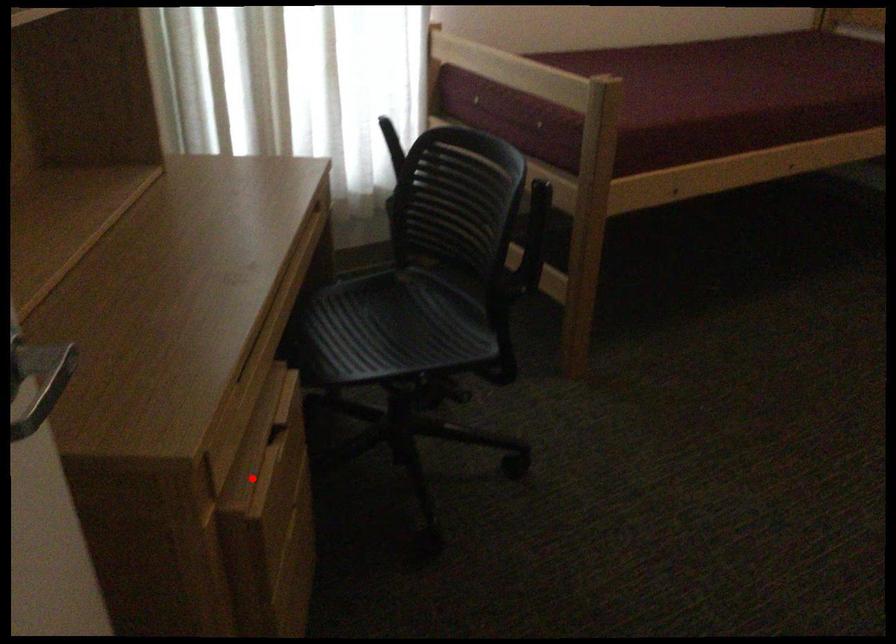
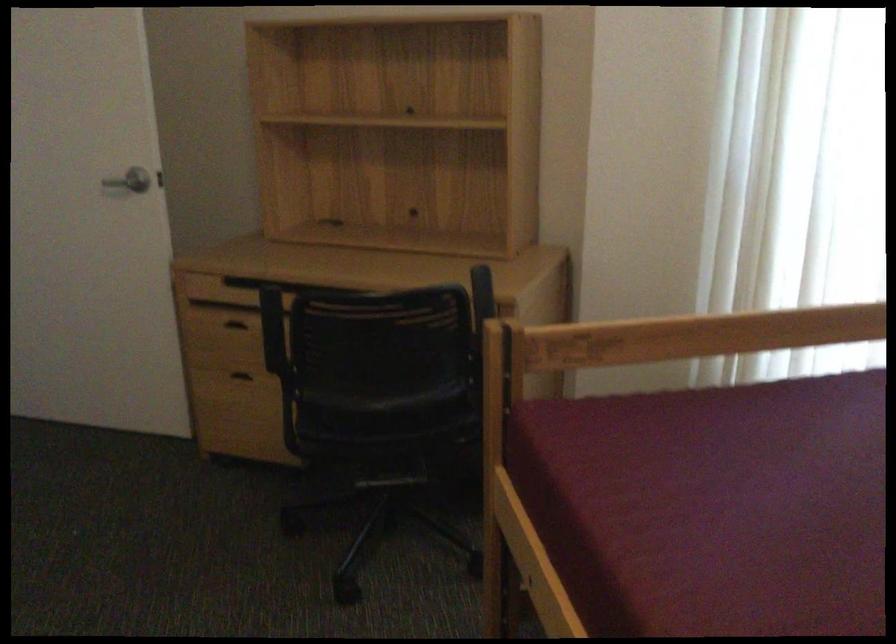
Question: I am providing you with two images of the same scene from different viewpoints. In image1, a red point is highlighted. Considering the same 3D point in image2, which of the following is correct?

Choices:
 (A) It is closer
 (B) It is farther

Answer: (B)